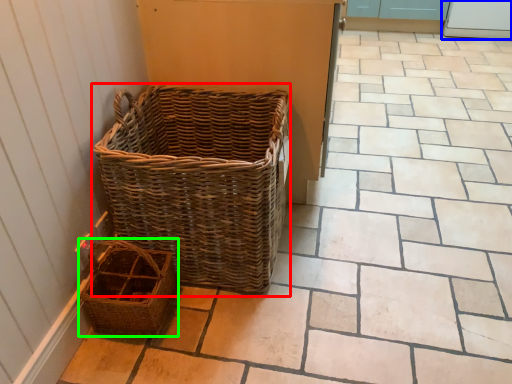
Question: Estimate the real-world distances between objects in this image. Which object is farther from picnic basket (highlighted by a red box), screen door (highlighted by a blue box) or picnic basket (highlighted by a green box)?

Choices:
 (A) screen door
 (B) picnic basket

Answer: (A)